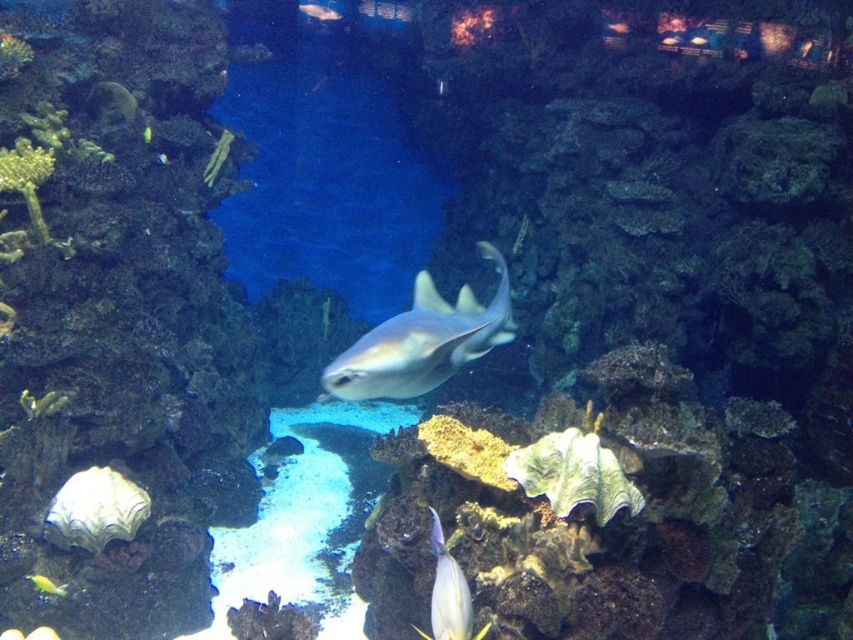
You are a marine biologist observing the underwater scene in the aquarium. You notice a specific point at coordinates point (91,104) that is part of the coral structure. If you want to place a sensor 2 meters away from this point, in which direction should you move it?

The point at point (91,104) is 4.88 meters away from the camera. To place the sensor 2 meters away from this point, you would need to move it towards the camera, reducing the distance to 2.88 meters from the camera.

You are a marine biologist observing the underwater scene in the aquarium. You notice a point marked at coordinates (422, 340). What object in the scene corresponds to this point?

The point at coordinates (422, 340) corresponds to the matte gray shark at center.

You are an underwater photographer aiming to capture a photo of the shark. You notice two fish, the smooth yellow fish at upper left and the shiny green fish at upper left. Which fish is taller when comparing their sizes?

The smooth yellow fish at upper left is taller than the shiny green fish at upper left according to the description.